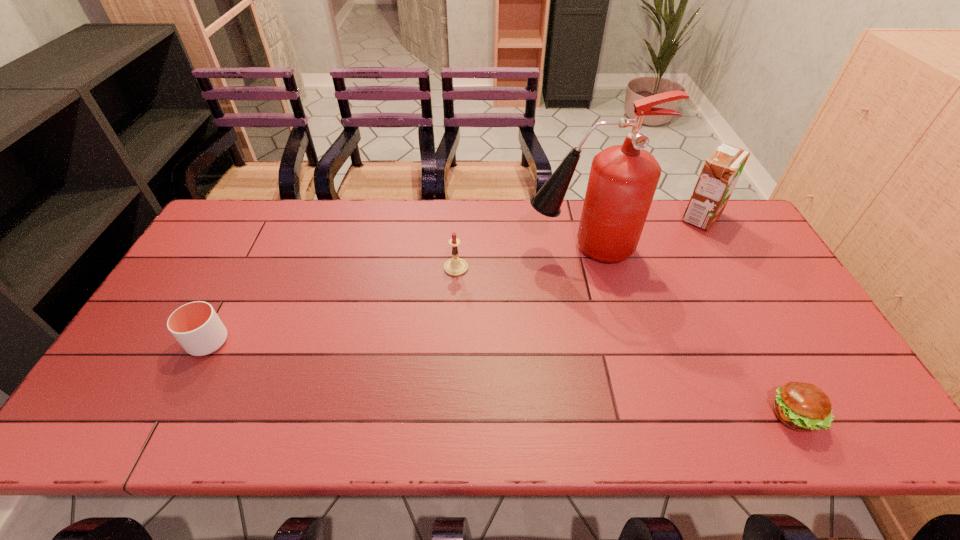
Identify the location of free space at the far right corner. This screenshot has width=960, height=540. (730, 241).

At what (x,y) coordinates should I click in order to perform the action: click on empty space that is in between the cup and the third object from right to left. Please return your answer as a coordinate pair (x, y). Image resolution: width=960 pixels, height=540 pixels. Looking at the image, I should click on coord(395,295).

I want to click on empty space between the carton and the nearest object, so click(748, 316).

Locate an element on the screen. unoccupied position between the fire extinguisher and the third tallest object is located at coordinates (518, 258).

You are a GUI agent. You are given a task and a screenshot of the screen. Output one action in this format:
    pyautogui.click(x=<x>, y=<y>)
    Task: Click on the free spot between the candle and the third object from right to left
    The height and width of the screenshot is (540, 960).
    Given the screenshot: What is the action you would take?
    pyautogui.click(x=518, y=258)

Identify the location of vacant space in between the second tallest object and the shortest object. The width and height of the screenshot is (960, 540). (748, 316).

Find the location of a particular element. the second closest object to the hamburger is located at coordinates (722, 169).

Identify which object is the nearest to the shortest object. Please provide its 2D coordinates. Your answer should be formatted as a tuple, i.e. [(x, y)], where the tuple contains the x and y coordinates of a point satisfying the conditions above.

[(623, 179)]

Locate an element on the screen. The height and width of the screenshot is (540, 960). free region that satisfies the following two spatial constraints: 1. with the nozzle aimed from the nearest object; 2. on the left side of the tallest object is located at coordinates coord(621,416).

The height and width of the screenshot is (540, 960). I want to click on free space that satisfies the following two spatial constraints: 1. on the straw side of the carton; 2. on the front side of the cup, so click(771, 342).